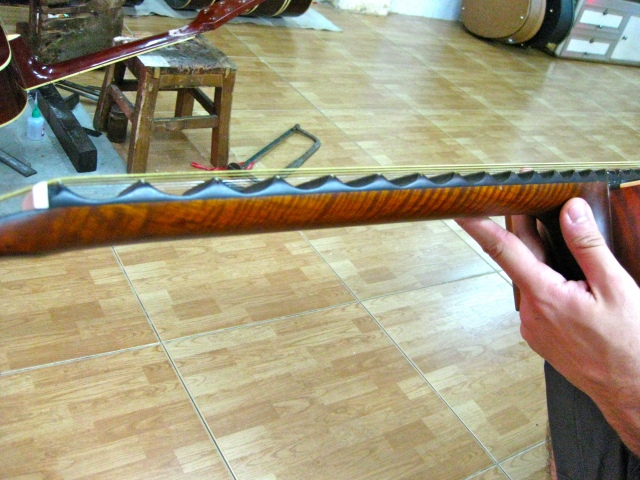
You are a GUI agent. You are given a task and a screenshot of the screen. Output one action in this format:
    pyautogui.click(x=<x>, y=<y>)
    Task: Click on the floor
    Image resolution: width=640 pixels, height=480 pixels.
    Given the screenshot: What is the action you would take?
    pyautogui.click(x=221, y=353)